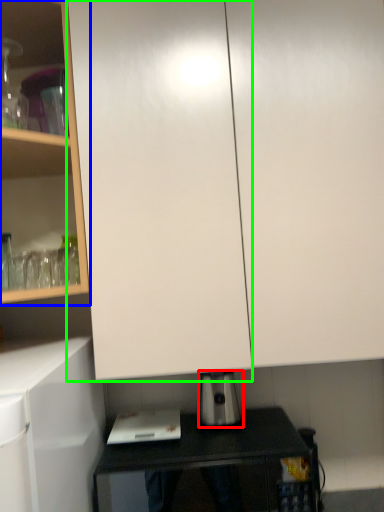
Question: Estimate the real-world distances between objects in this image. Which object is farther from kitchen appliance (highlighted by a red box), cabinetry (highlighted by a blue box) or glass door (highlighted by a green box)?

Choices:
 (A) cabinetry
 (B) glass door

Answer: (A)